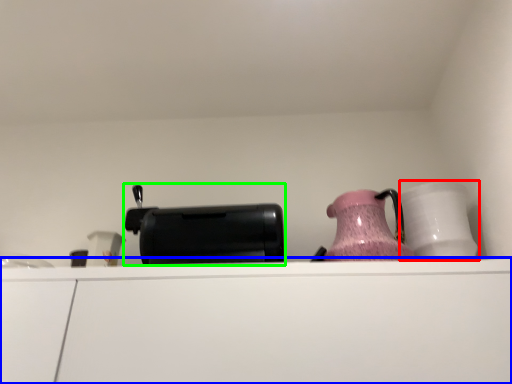
Question: Considering the real-world distances, which object is farthest from tableware (highlighted by a red box)? cabinetry (highlighted by a blue box) or appliance (highlighted by a green box)?

Choices:
 (A) cabinetry
 (B) appliance

Answer: (B)